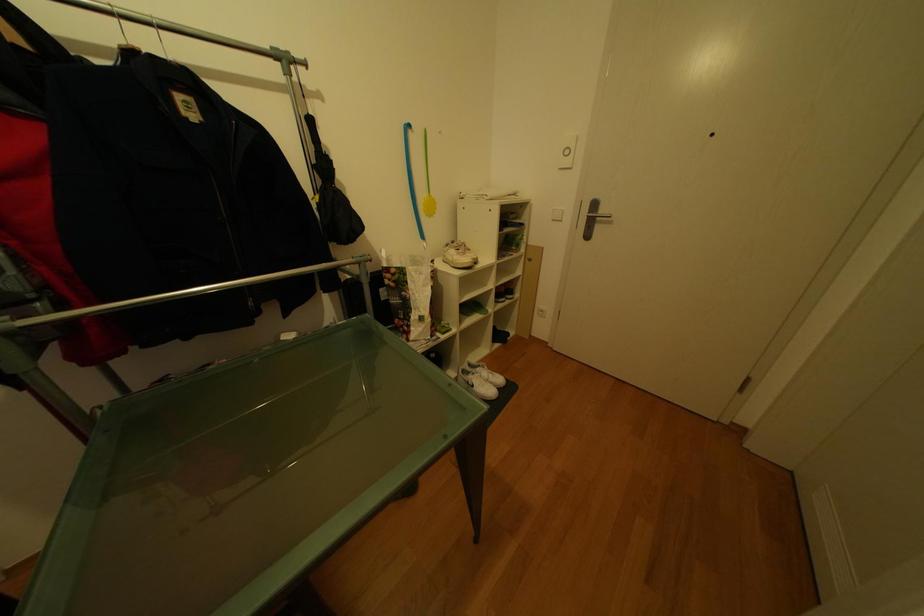
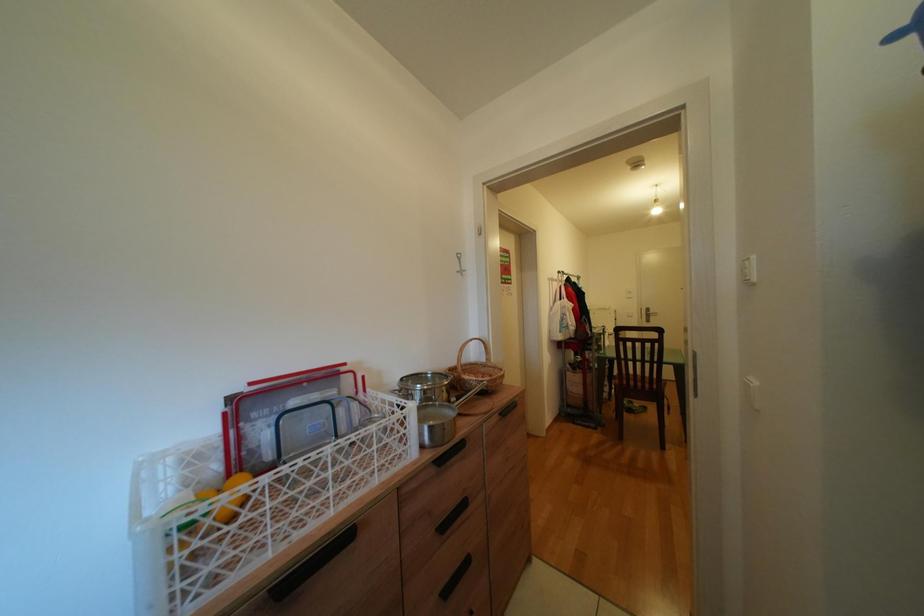
The images are taken continuously from a first-person perspective. In which direction are you moving?

The cameraman walked toward left, backward.